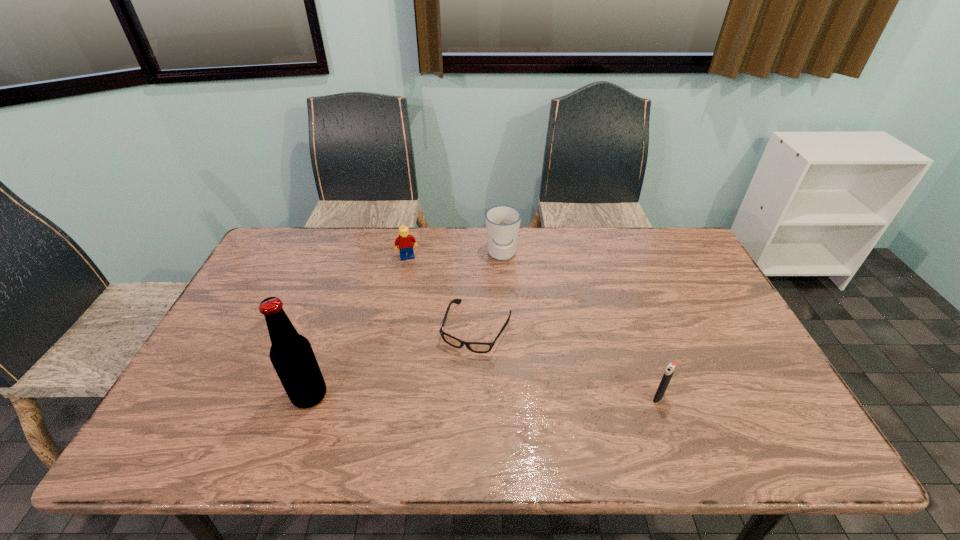
The image size is (960, 540). Find the location of `blank region between the shortest object and the second tallest object`. blank region between the shortest object and the second tallest object is located at coordinates (490, 291).

You are a GUI agent. You are given a task and a screenshot of the screen. Output one action in this format:
    pyautogui.click(x=<x>, y=<y>)
    Task: Click on the vacant region between the second tallest object and the shortest object
    The image size is (960, 540).
    Given the screenshot: What is the action you would take?
    pyautogui.click(x=490, y=291)

Where is `empty space between the rightmost object and the leftmost object`? The image size is (960, 540). empty space between the rightmost object and the leftmost object is located at coordinates (484, 397).

Identify the location of vacant point located between the second object from left to right and the leftmost object. (358, 327).

This screenshot has width=960, height=540. What are the coordinates of `empty space that is in between the cup and the igniter` in the screenshot? It's located at (580, 326).

Identify the location of free area in between the third nearest object and the rightmost object. (567, 362).

Image resolution: width=960 pixels, height=540 pixels. Find the location of `vacant region between the Lego and the spectacles`. vacant region between the Lego and the spectacles is located at coordinates (443, 292).

I want to click on the fourth closest object to the fourth object from right to left, so click(x=671, y=367).

Where is `the second closest object to the igniter`? This screenshot has width=960, height=540. the second closest object to the igniter is located at coordinates (502, 222).